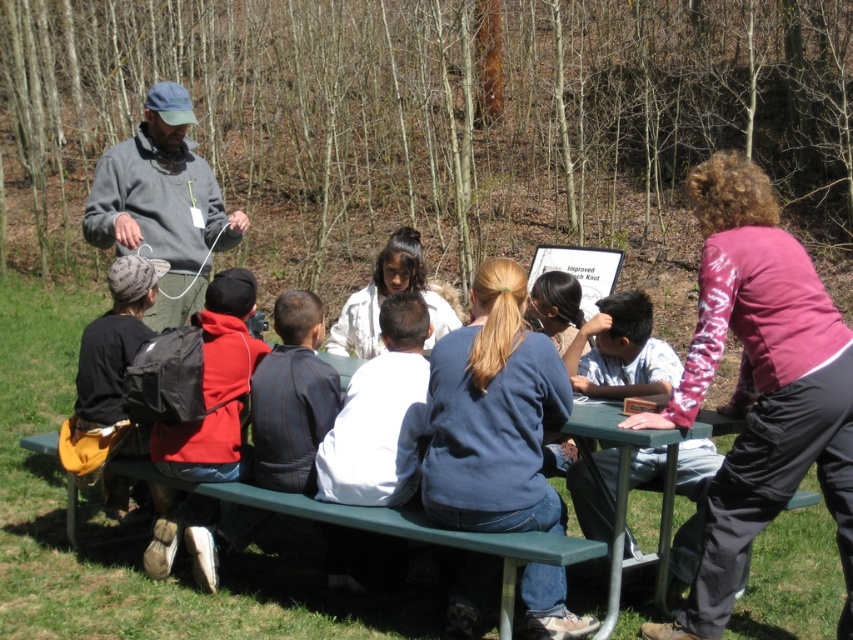
Can you confirm if gray fleece jacket at upper left is positioned above green painted wood table at lower center?

Yes, gray fleece jacket at upper left is above green painted wood table at lower center.

Between point (131, 204) and point (614, 602), which one is positioned behind?

The point (131, 204) is behind.

This screenshot has height=640, width=853. I want to click on gray fleece jacket at upper left, so click(161, 204).